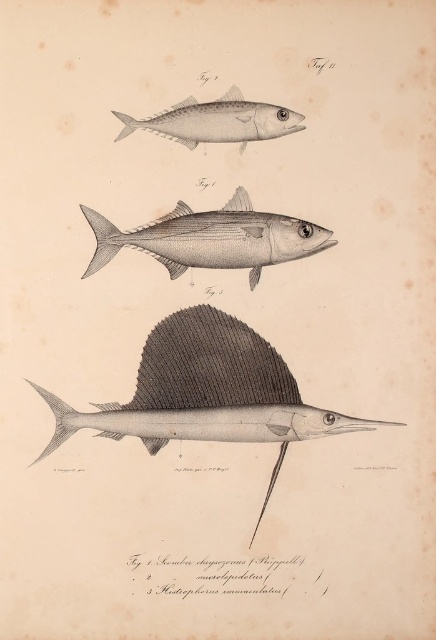
Based on the illustration labeled as Fig. 1, which fish is positioned closer to the viewer between the gray matte sailfish at center and the grayish silver fish at center?

The gray matte sailfish at center is positioned closer to the viewer than the grayish silver fish at center.

In the scientific illustration labeled as Fig. 1, there is a gray matte sailfish at center and a grayish silver fish at center. Which of these two fish has a greater width?

The gray matte sailfish at center has a greater width than the grayish silver fish at center.

Looking at this image, you are a marine biologist examining the illustration. You need to identify which fish is on the right side between the gray matte sailfish at center and the gray matte fish at upper center. Which one is it?

Answer: The gray matte sailfish at center is positioned on the right side of the gray matte fish at upper center, so the gray matte sailfish at center is the one on the right.